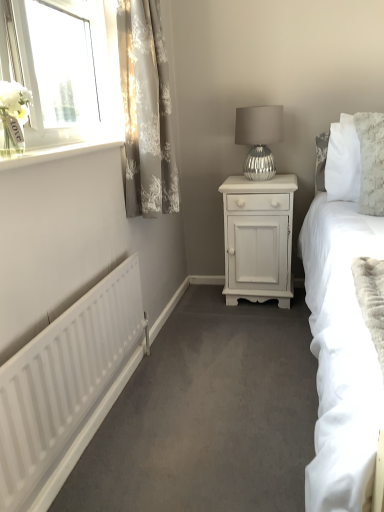
What are the coordinates of `vacant space underneath white matte radiator at lower left (from a real-world perspective)` in the screenshot? It's located at (100, 434).